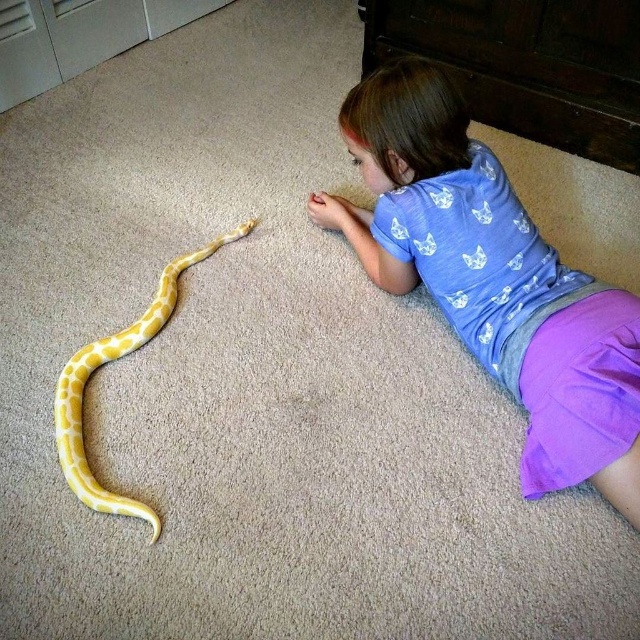
Question: Is purple cotton shorts at lower right bigger than yellow matte snake at center?

Choices:
 (A) no
 (B) yes

Answer: (B)

Question: Which object is closer to the camera taking this photo?

Choices:
 (A) yellow matte snake at center
 (B) purple cotton shorts at lower right

Answer: (B)

Question: In this image, where is purple cotton shorts at lower right located relative to yellow matte snake at center?

Choices:
 (A) above
 (B) below

Answer: (A)

Question: Does purple cotton shorts at lower right have a larger size compared to yellow matte snake at center?

Choices:
 (A) yes
 (B) no

Answer: (A)